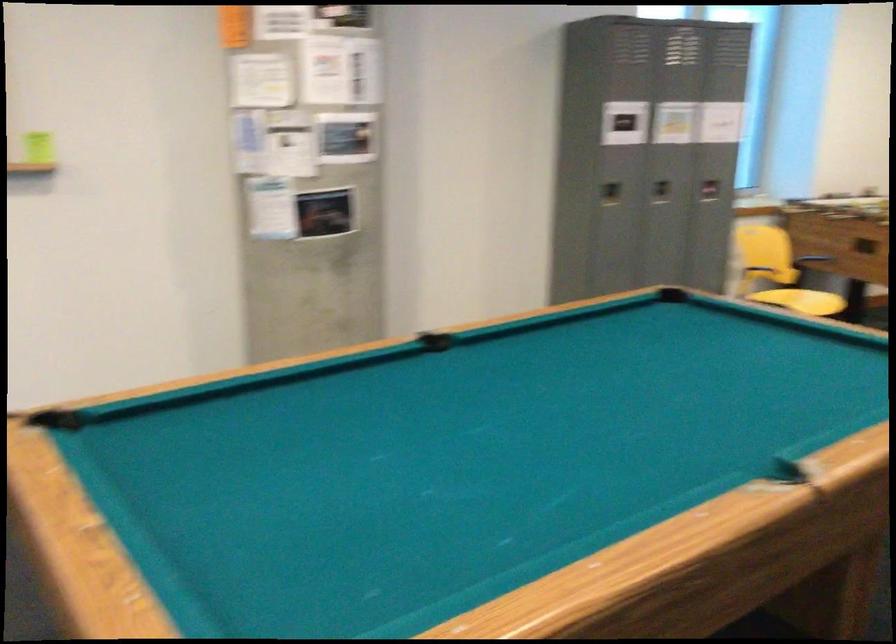
Find where to sit the yellow chair sitting surface. Please return your answer as a coordinate pair (x, y).

(800, 301)